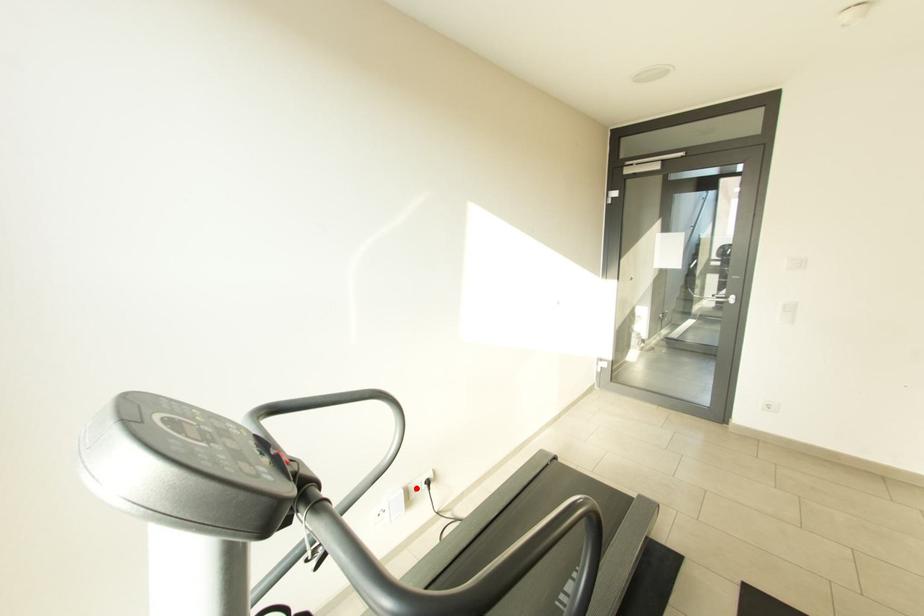
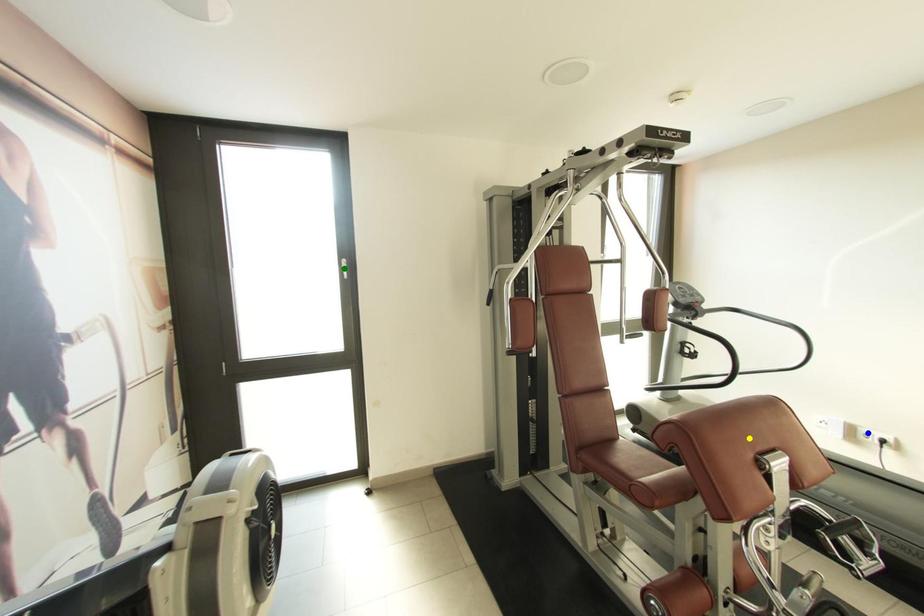
Question: I am providing you with two images of the same scene from different viewpoints. A red point is marked on the first image. You are given multiple points on the second image. Which mark in image 2 goes with the point in image 1?

Choices:
 (A) green point
 (B) blue point
 (C) yellow point

Answer: (B)